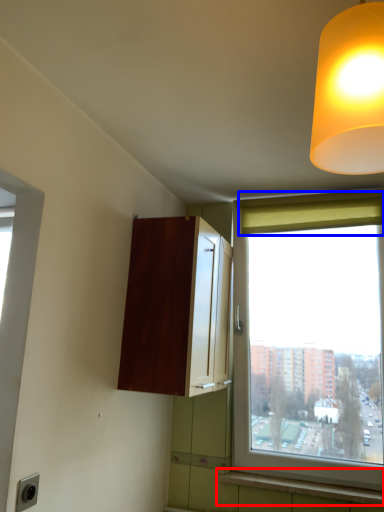
Question: Which of the following is the closest to the observer, window sill (highlighted by a red box) or curtain (highlighted by a blue box)?

Choices:
 (A) window sill
 (B) curtain

Answer: (A)